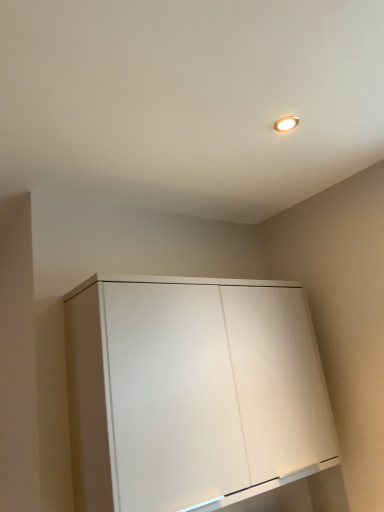
What do you see at coordinates (192, 392) in the screenshot?
I see `white matte cabinet at lower center` at bounding box center [192, 392].

At what (x,y) coordinates should I click in order to perform the action: click on white matte cabinet at lower center. Please return your answer as a coordinate pair (x, y). The width and height of the screenshot is (384, 512). Looking at the image, I should click on (192, 392).

Consider the image. Measure the distance between point (101, 290) and camera.

Point (101, 290) and camera are 4.56 feet apart.

Find the location of a particular element. The width and height of the screenshot is (384, 512). white matte cabinet at lower center is located at coordinates (192, 392).